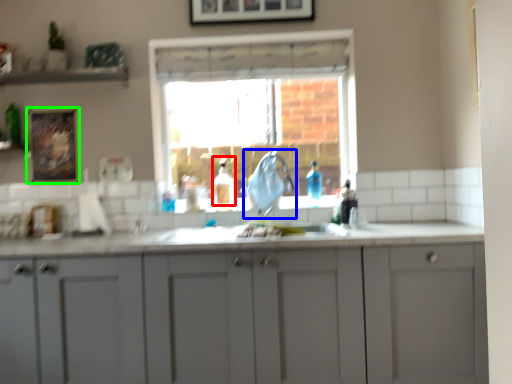
Question: Based on their relative distances, which object is farther from bottle (highlighted by a red box)? Choose from faucet (highlighted by a blue box) and picture frame (highlighted by a green box).

Choices:
 (A) faucet
 (B) picture frame

Answer: (B)